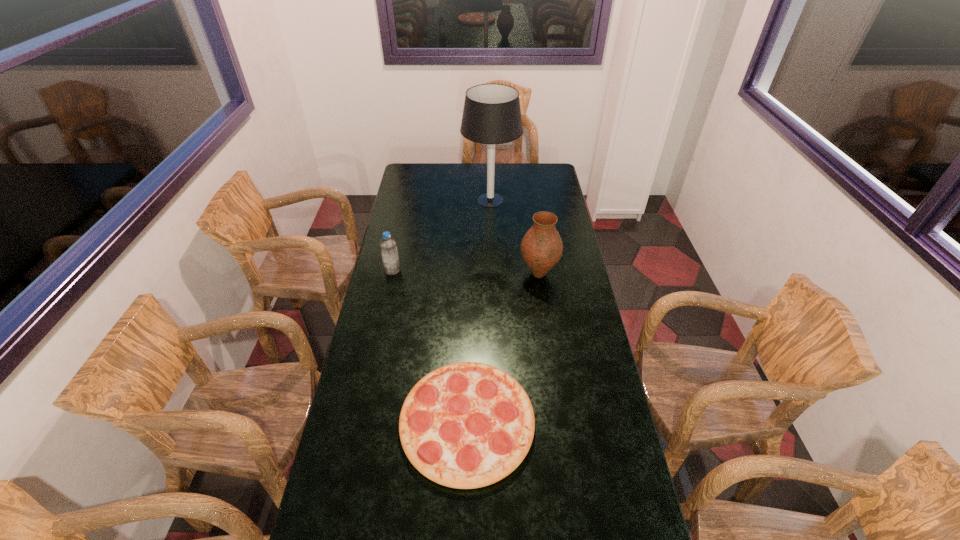
Identify which object is the nearest to the table lamp. Please provide its 2D coordinates. Your answer should be formatted as a tuple, i.e. [(x, y)], where the tuple contains the x and y coordinates of a point satisfying the conditions above.

[(541, 248)]

Find the location of a particular element. This screenshot has width=960, height=540. vacant space that satisfies the following two spatial constraints: 1. on the front side of the water bottle; 2. on the right side of the nearest object is located at coordinates (360, 422).